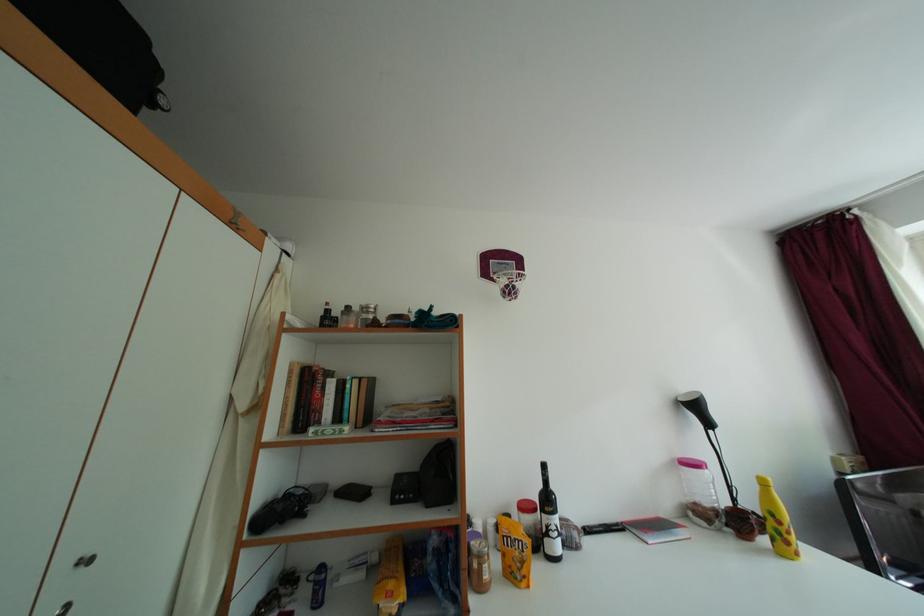
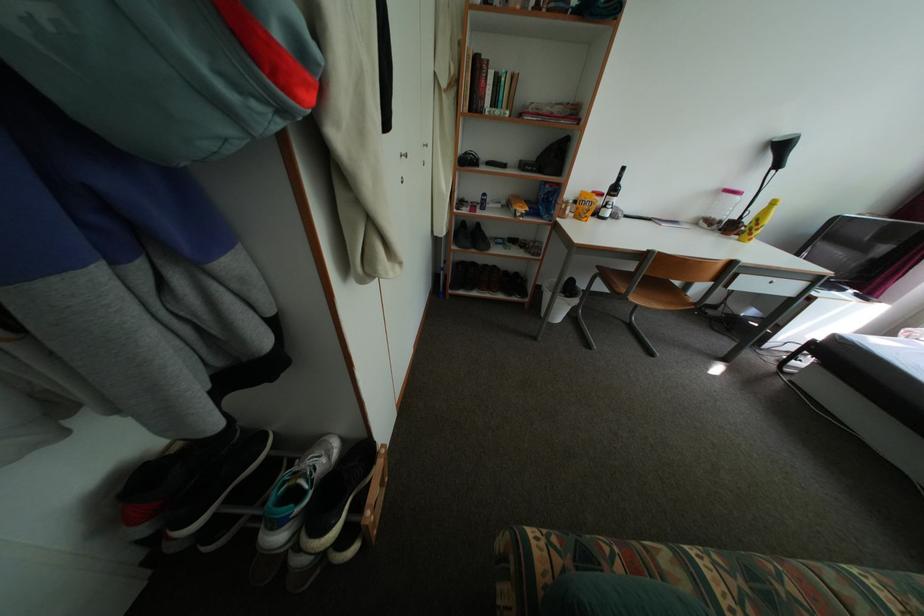
Question: The images are taken continuously from a first-person perspective. In which direction is your viewpoint rotating?

Choices:
 (A) Left
 (B) Right
 (C) Up
 (D) Down

Answer: (D)